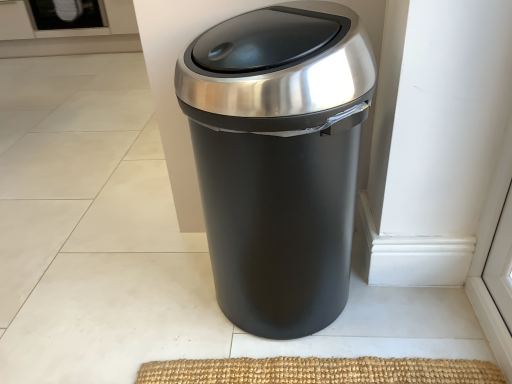
Find the location of a particular element. The width and height of the screenshot is (512, 384). vacant space to the right of matte black trash can at center is located at coordinates (396, 314).